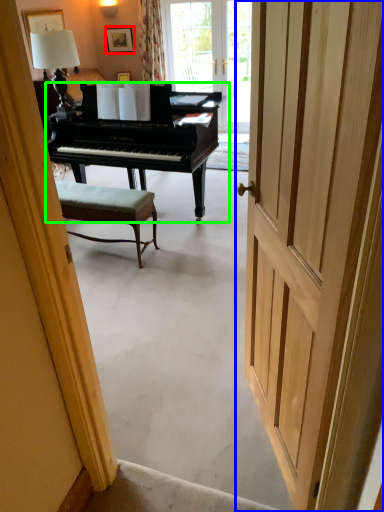
Question: Which is farther away from picture frame (highlighted by a red box)? door (highlighted by a blue box) or piano (highlighted by a green box)?

Choices:
 (A) door
 (B) piano

Answer: (A)